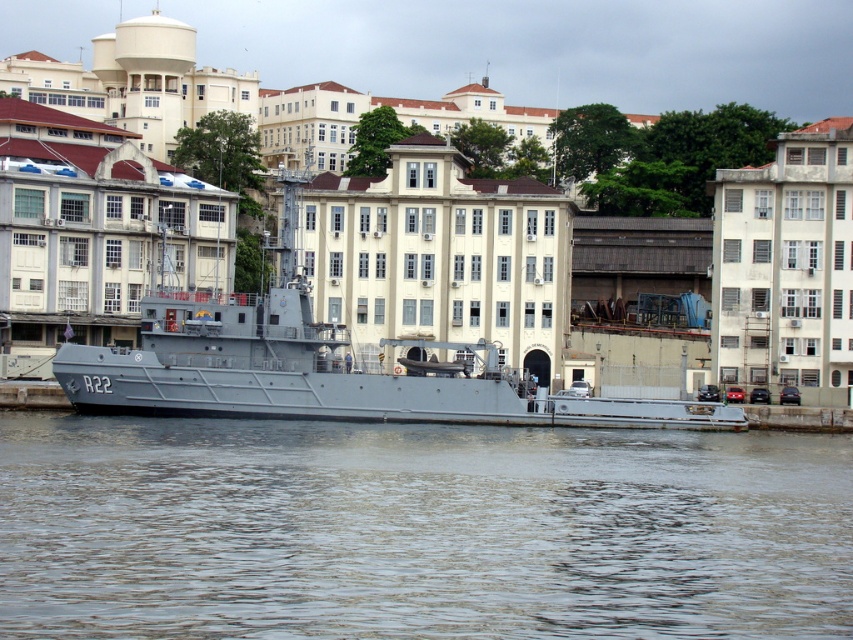
Who is positioned more to the right, gray water at center or gray matte boat at center?

Positioned to the right is gray water at center.

Is gray water at center positioned before gray matte boat at center?

Yes, gray water at center is in front of gray matte boat at center.

Where is `gray water at center`? This screenshot has width=853, height=640. gray water at center is located at coordinates (416, 531).